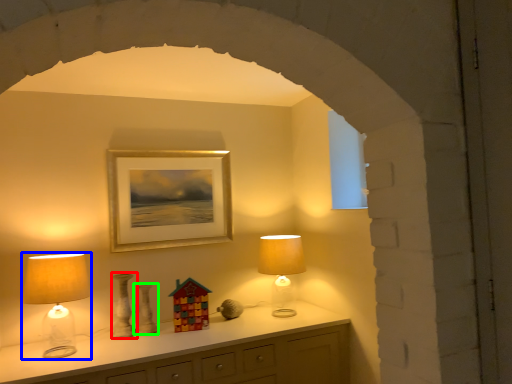
Question: Which object is positioned farthest from vase (highlighted by a red box)? Select from lamp (highlighted by a blue box) and vase (highlighted by a green box).

Choices:
 (A) lamp
 (B) vase

Answer: (A)